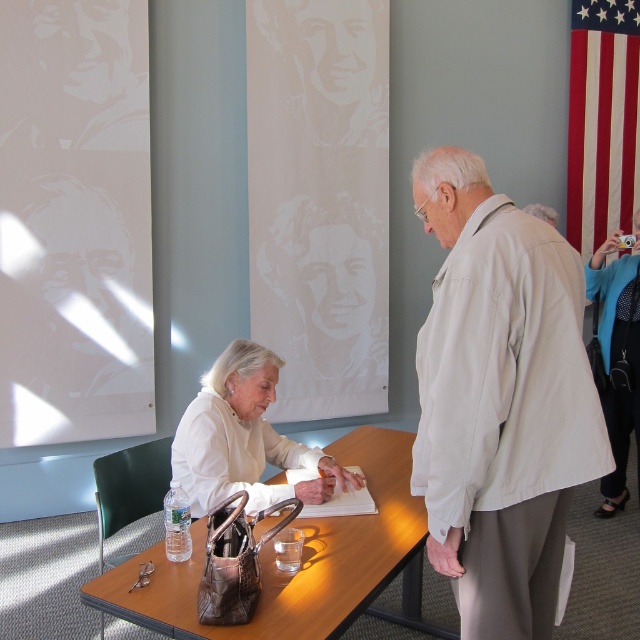
You are a photographer standing 2 meters away from the light beige shirt at center. You want to take a photo of it. Can you step forward to get a closer shot without moving the subject?

The light beige shirt at center is currently 1.44 meters away from the camera. Since you are standing 2 meters away, you can step forward to reduce the distance to 1.44 meters to capture the shot without moving the subject.

You are standing in the room and want to locate the light beige shirt at center. According to the coordinates provided, where should you look?

The light beige shirt at center is located at coordinates point 0.627 on the x axis and 0.783 on the y axis.